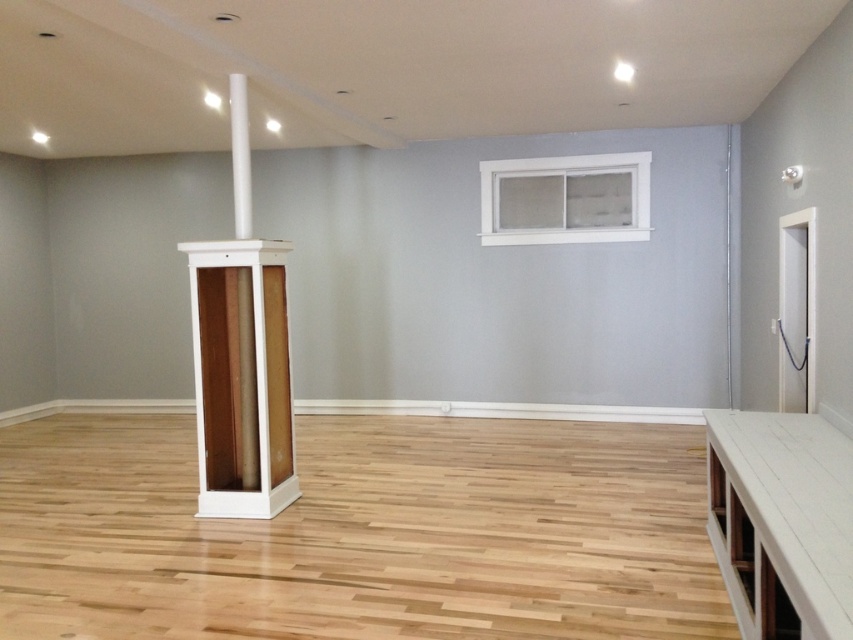
Does white wood cabinet at center have a lesser width compared to white painted wood window at upper right?

Yes, white wood cabinet at center is thinner than white painted wood window at upper right.

Does white wood cabinet at center lie in front of white painted wood window at upper right?

Yes, white wood cabinet at center is in front of white painted wood window at upper right.

Is point (277, 493) positioned in front of point (625, 227)?

Yes, it is in front of point (625, 227).

Identify the location of white wood cabinet at center. The height and width of the screenshot is (640, 853). (238, 376).

Does white painted wood table at lower right appear on the right side of white painted wood window at upper right?

Yes, white painted wood table at lower right is to the right of white painted wood window at upper right.

Which is behind, point (799, 496) or point (639, 172)?

Positioned behind is point (639, 172).

Does point (721, 504) come behind point (540, 180)?

No, (721, 504) is in front of (540, 180).

Find the location of a particular element. The width and height of the screenshot is (853, 640). white painted wood table at lower right is located at coordinates (781, 522).

Is white painted wood table at lower right further to the viewer compared to white wood pillar at center?

That is False.

Based on the photo, can you confirm if white painted wood table at lower right is positioned above white wood pillar at center?

No.

Which is in front, point (782, 451) or point (241, 220)?

Point (782, 451) is in front.

Identify the location of white painted wood table at lower right. Image resolution: width=853 pixels, height=640 pixels. (781, 522).